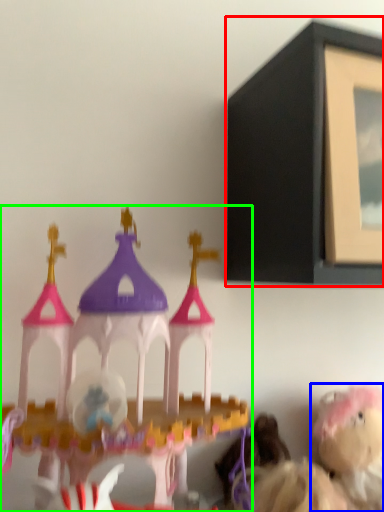
Question: Which is farther away from picture frame (highlighted by a red box)? toy (highlighted by a blue box) or toy (highlighted by a green box)?

Choices:
 (A) toy
 (B) toy

Answer: (A)